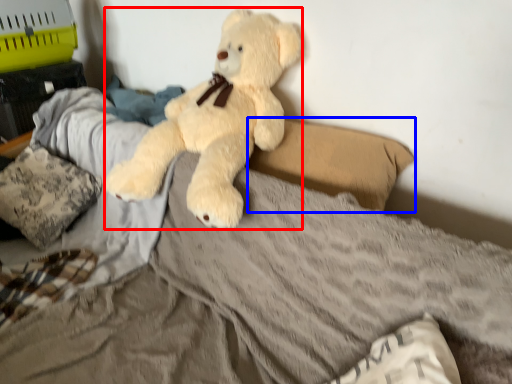
Question: Which point is closer to the camera, teddy bear (highlighted by a red box) or pillow (highlighted by a blue box)?

Choices:
 (A) teddy bear
 (B) pillow

Answer: (A)